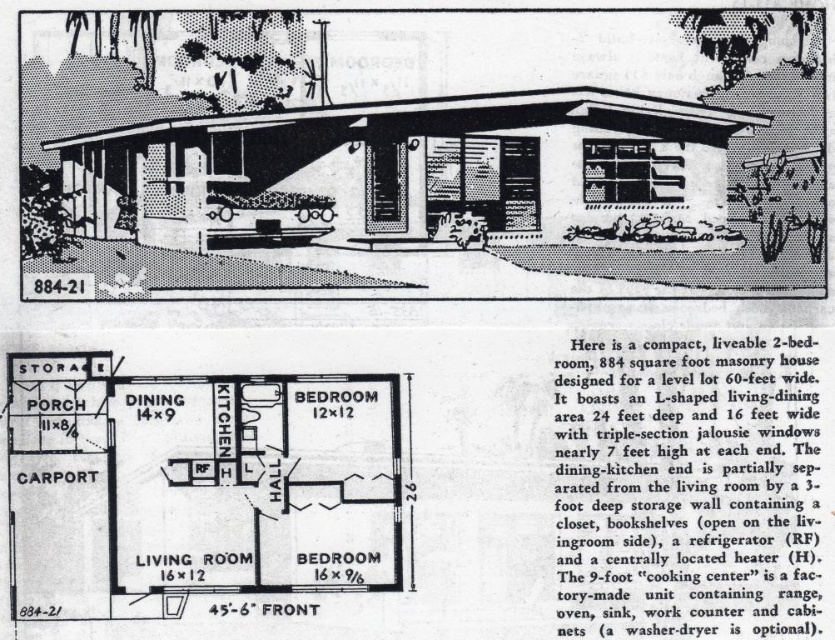
Based on the exterior view of the mid century modern house labeled 884 21, which object is bigger the white textured carport at lower left or the white glossy kitchen at center?

The white textured carport at lower left is larger in size than the white glossy kitchen at center.

You are standing at the camera position looking at the exterior of the house in the image. There is a point marked at coordinates point [281,189]. Can you estimate how far this point is from your current position?

The point [281,189] is 3.84 feet away from the camera position.

Based on the exterior view of the mid century modern house labeled 884 21, where is the white textured carport at lower left in relation to the white glossy kitchen at center?

The white textured carport at lower left is located above the white glossy kitchen at center.